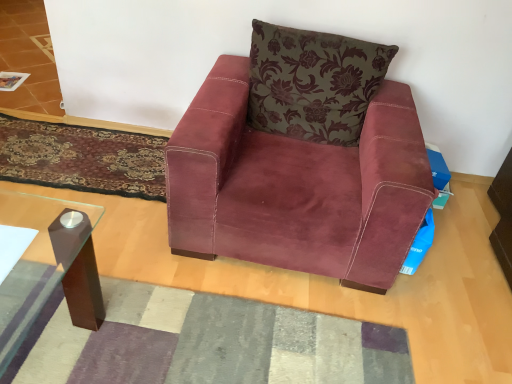
Question: Is suede-like burgundy armchair at center positioned far away from velvet floral pillow at center?

Choices:
 (A) no
 (B) yes

Answer: (A)

Question: Is velvet floral pillow at center at the back of suede-like burgundy armchair at center?

Choices:
 (A) no
 (B) yes

Answer: (B)

Question: Is suede-like burgundy armchair at center smaller than velvet floral pillow at center?

Choices:
 (A) no
 (B) yes

Answer: (A)

Question: Is suede-like burgundy armchair at center positioned beyond the bounds of velvet floral pillow at center?

Choices:
 (A) yes
 (B) no

Answer: (A)

Question: Is suede-like burgundy armchair at center wider than velvet floral pillow at center?

Choices:
 (A) yes
 (B) no

Answer: (A)

Question: Considering the positions of velvet floral pillow at center and suede-like burgundy armchair at center in the image, is velvet floral pillow at center bigger or smaller than suede-like burgundy armchair at center?

Choices:
 (A) big
 (B) small

Answer: (B)

Question: Considering their positions, is velvet floral pillow at center located in front of or behind suede-like burgundy armchair at center?

Choices:
 (A) front
 (B) behind

Answer: (B)

Question: Looking at their shapes, would you say velvet floral pillow at center is wider or thinner than suede-like burgundy armchair at center?

Choices:
 (A) thin
 (B) wide

Answer: (A)

Question: From the image's perspective, is velvet floral pillow at center positioned above or below suede-like burgundy armchair at center?

Choices:
 (A) below
 (B) above

Answer: (B)

Question: From a real-world perspective, is suede-like burgundy armchair at center above or below velvet floral pillow at center?

Choices:
 (A) below
 (B) above

Answer: (A)

Question: In terms of width, does suede-like burgundy armchair at center look wider or thinner when compared to velvet floral pillow at center?

Choices:
 (A) wide
 (B) thin

Answer: (A)

Question: Is suede-like burgundy armchair at center spatially inside velvet floral pillow at center, or outside of it?

Choices:
 (A) inside
 (B) outside

Answer: (B)

Question: Relative to velvet floral pillow at center, is suede-like burgundy armchair at center in front or behind?

Choices:
 (A) front
 (B) behind

Answer: (A)

Question: In the image, is velvet-like burgundy mat at lower left, the 1th mat in the back-to-front sequence, positioned in front of or behind velvet floral pillow at center?

Choices:
 (A) front
 (B) behind

Answer: (B)

Question: Is velvet-like burgundy mat at lower left, which ranks as the second mat in bottom-to-top order, inside the boundaries of velvet floral pillow at center, or outside?

Choices:
 (A) inside
 (B) outside

Answer: (B)